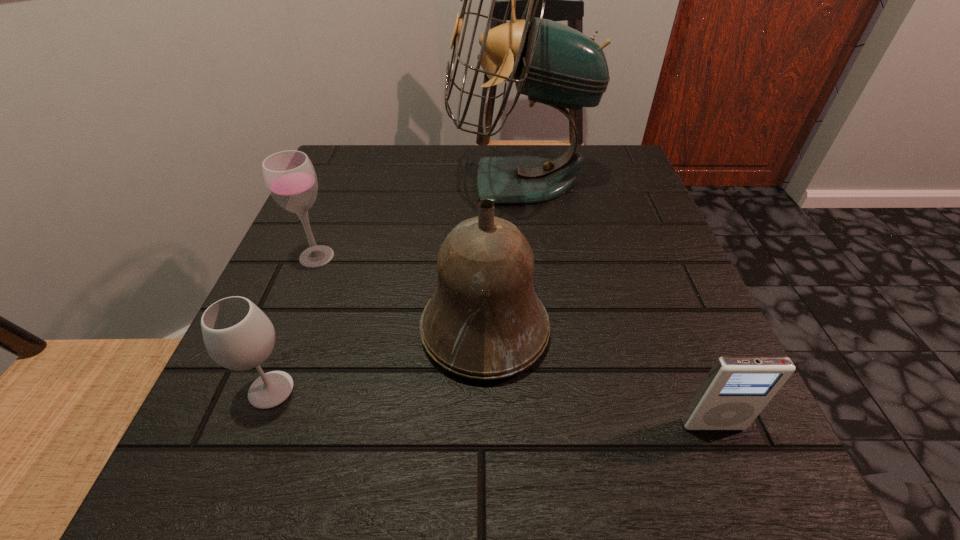
Where is `vacant space that is in between the shorter wineglass and the fourth nearest object`? Image resolution: width=960 pixels, height=540 pixels. vacant space that is in between the shorter wineglass and the fourth nearest object is located at coordinates [x=294, y=323].

Where is `free space between the farthest object and the nearer wineglass`? free space between the farthest object and the nearer wineglass is located at coordinates (396, 286).

The width and height of the screenshot is (960, 540). I want to click on free area in between the bell and the third tallest object, so click(x=400, y=293).

This screenshot has height=540, width=960. I want to click on object that stands as the third closest to the farther wineglass, so click(238, 335).

Locate which object is the closest to the bell. Please provide its 2D coordinates. Your answer should be formatted as a tuple, i.e. [(x, y)], where the tuple contains the x and y coordinates of a point satisfying the conditions above.

[(238, 335)]

Find the location of a particular element. Image resolution: width=960 pixels, height=540 pixels. blank space that satisfies the following two spatial constraints: 1. on the front-facing side of the tallest object for air flow; 2. on the front side of the bell is located at coordinates (537, 330).

Locate an element on the screen. vacant area in the image that satisfies the following two spatial constraints: 1. on the front-facing side of the farthest object for air flow; 2. on the front side of the farther wineglass is located at coordinates (528, 256).

Where is `free space that satisfies the following two spatial constraints: 1. on the front-facing side of the tallest object for air flow; 2. on the front side of the farther wineglass`? free space that satisfies the following two spatial constraints: 1. on the front-facing side of the tallest object for air flow; 2. on the front side of the farther wineglass is located at coordinates (528, 256).